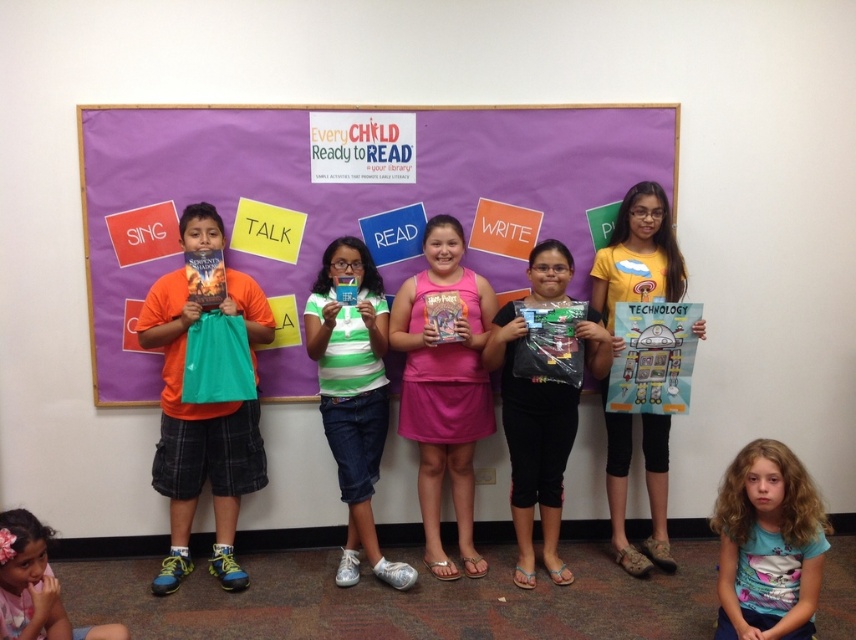
Based on the scene description, what object corresponds to the coordinates point (197, 442)?

The orange fabric shirt at left corresponds to the coordinates point (197, 442).